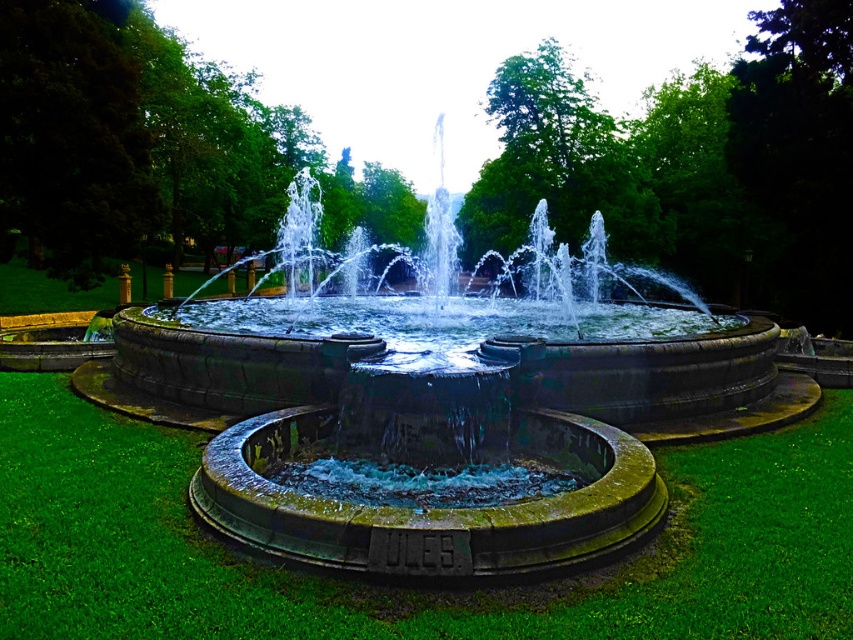
You are a landscape architect designing a new park. You have to place a new statue exactly between the green stone fountain at center and the green mossy grass at center. Which object will the statue be closer to?

The statue will be closer to the green mossy grass at center because the green stone fountain at center is bigger than the green mossy grass at center, meaning the grass area is smaller and the distance between them would require the statue to be placed closer to the smaller object.

You are standing in the park and want to know which object is higher between the green stone fountain at center and the green mossy grass at center. Which one is higher?

The green stone fountain at center is above the green mossy grass at center, so the green stone fountain at center is higher.

A child wants to throw a ball from the green stone fountain at center to the green mossy grass at center. Given that the child can throw the ball 4 meters, will the ball reach the grass?

The green stone fountain at center and green mossy grass at center are 4.62 meters apart from each other. Since the child can only throw 4 meters, the ball will not reach the grass.